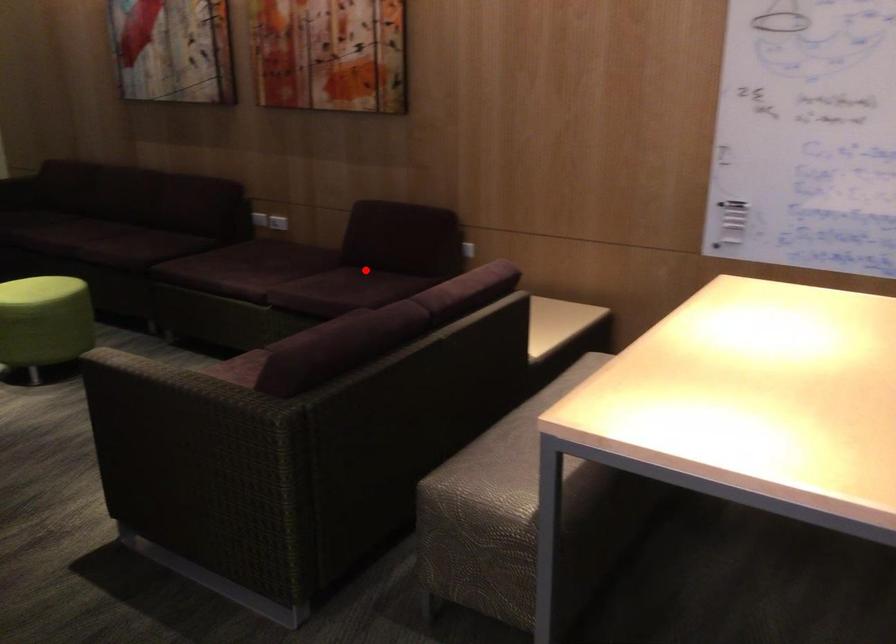
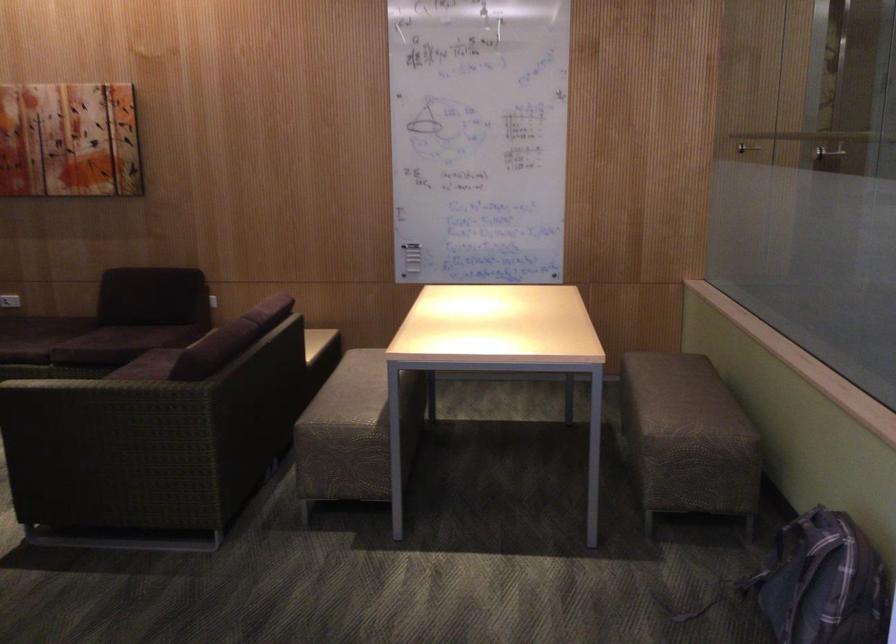
Locate, in the second image, the point that corresponds to the highlighted location in the first image.

(123, 322)